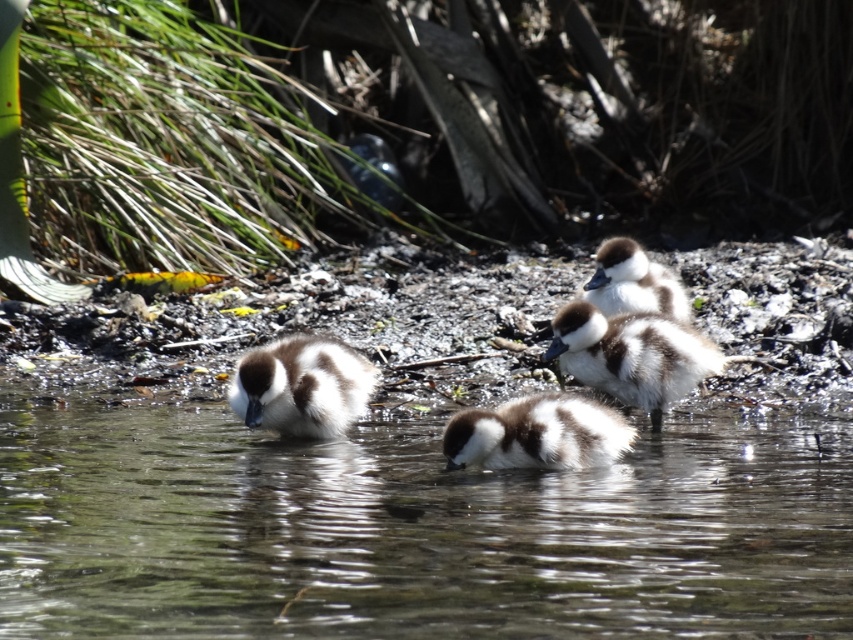
Can you confirm if brown speckled duckling at center is positioned above brown fluffy duckling at upper right?

Actually, brown speckled duckling at center is below brown fluffy duckling at upper right.

What do you see at coordinates (302, 387) in the screenshot? The width and height of the screenshot is (853, 640). I see `brown speckled duckling at center` at bounding box center [302, 387].

Is point (294, 333) in front of point (630, 305)?

Yes, it is in front of point (630, 305).

Locate an element on the screen. brown speckled duckling at center is located at coordinates (302, 387).

Between point (671, 330) and point (329, 387), which one is positioned behind?

The point (671, 330) is more distant.

Between point (566, 349) and point (306, 387), which one is positioned in front?

Point (306, 387) is in front.

This screenshot has width=853, height=640. Find the location of `brown fluffy duckling at center`. brown fluffy duckling at center is located at coordinates (631, 355).

Between brown fluffy duckling at center and brown and white fluffy duckling at center, which one has less height?

With less height is brown and white fluffy duckling at center.

Which is more to the right, brown fluffy duckling at center or brown and white fluffy duckling at center?

brown fluffy duckling at center

Identify the location of brown fluffy duckling at center. This screenshot has height=640, width=853. (631, 355).

You are a GUI agent. You are given a task and a screenshot of the screen. Output one action in this format:
    pyautogui.click(x=<x>, y=<y>)
    Task: Click on the brown fluffy duckling at center
    This screenshot has height=640, width=853.
    Given the screenshot: What is the action you would take?
    pyautogui.click(x=631, y=355)